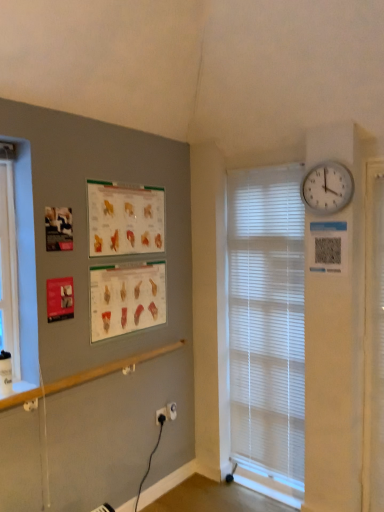
Question: Considering the relative sizes of matte paper poster at center left, which appears as the 2th poster page when ordered from the bottom, and white plastic bay window at left in the image provided, is matte paper poster at center left, which appears as the 2th poster page when ordered from the bottom, wider than white plastic bay window at left?

Choices:
 (A) no
 (B) yes

Answer: (A)

Question: Does matte paper poster at center left, the first poster page positioned from the top, have a greater height compared to white plastic bay window at left?

Choices:
 (A) yes
 (B) no

Answer: (B)

Question: Is matte paper poster at center left, the first poster page positioned from the top, not near white plastic bay window at left?

Choices:
 (A) yes
 (B) no

Answer: (B)

Question: Is matte paper poster at center left, which appears as the 2th poster page when ordered from the bottom, further to the viewer compared to white plastic bay window at left?

Choices:
 (A) yes
 (B) no

Answer: (A)

Question: Is matte paper poster at center left, which appears as the 2th poster page when ordered from the bottom, positioned before white plastic bay window at left?

Choices:
 (A) yes
 (B) no

Answer: (B)

Question: From a real-world perspective, is matte paper poster at center left, which appears as the 2th poster page when ordered from the bottom, beneath white plastic bay window at left?

Choices:
 (A) yes
 (B) no

Answer: (B)

Question: Is white plastic wall clock at upper right surrounded by white plastic blinds at center?

Choices:
 (A) yes
 (B) no

Answer: (B)

Question: From the image's perspective, is white plastic blinds at center under white plastic wall clock at upper right?

Choices:
 (A) yes
 (B) no

Answer: (A)

Question: Is white plastic blinds at center further to the viewer compared to white plastic wall clock at upper right?

Choices:
 (A) no
 (B) yes

Answer: (B)

Question: Considering the relative positions of white plastic blinds at center and white plastic wall clock at upper right in the image provided, is white plastic blinds at center in front of white plastic wall clock at upper right?

Choices:
 (A) no
 (B) yes

Answer: (A)

Question: From the image's perspective, is white plastic blinds at center over white plastic wall clock at upper right?

Choices:
 (A) no
 (B) yes

Answer: (A)

Question: Could you tell me if white plastic blinds at center is facing white plastic wall clock at upper right?

Choices:
 (A) yes
 (B) no

Answer: (B)

Question: Is white plastic electric outlet at lower center surrounding white plastic wall clock at upper right?

Choices:
 (A) no
 (B) yes

Answer: (A)